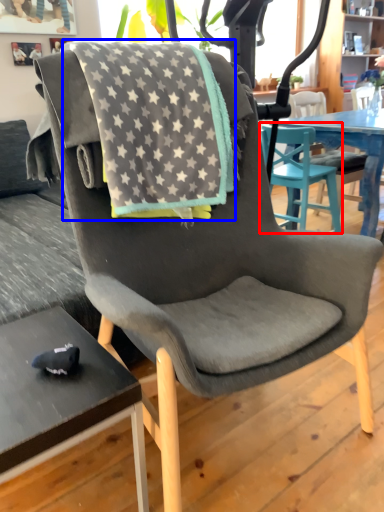
Question: Which object is closer to the camera taking this photo, chair (highlighted by a red box) or beach towel (highlighted by a blue box)?

Choices:
 (A) chair
 (B) beach towel

Answer: (B)